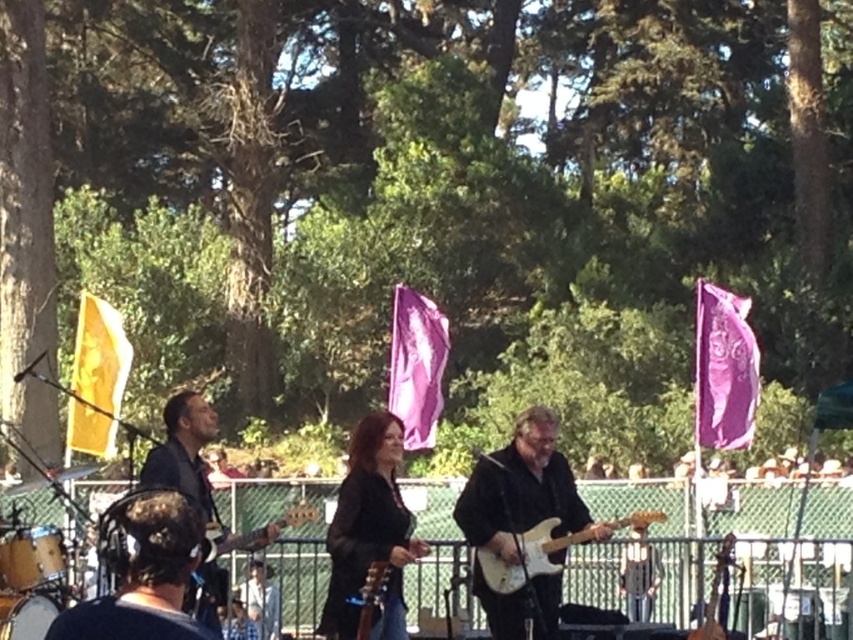
Which is above, purple fabric flag at right or metallic gold guitar at center?

purple fabric flag at right

This screenshot has height=640, width=853. Describe the element at coordinates (724, 369) in the screenshot. I see `purple fabric flag at right` at that location.

The height and width of the screenshot is (640, 853). In order to click on purple fabric flag at right in this screenshot , I will do `click(724, 369)`.

Image resolution: width=853 pixels, height=640 pixels. What are the coordinates of `purple fabric flag at right` in the screenshot? It's located at (724, 369).

Can you confirm if purple fabric flag at right is positioned below purple fabric flag at center?

Incorrect, purple fabric flag at right is not positioned below purple fabric flag at center.

Does point (740, 408) lie in front of point (426, 346)?

That is True.

Identify the location of purple fabric flag at right. (724, 369).

Is matte yellow flag at left shorter than white glossy electric guitar at center?

No.

Is matte yellow flag at left smaller than white glossy electric guitar at center?

Incorrect, matte yellow flag at left is not smaller in size than white glossy electric guitar at center.

The height and width of the screenshot is (640, 853). Find the location of `matte yellow flag at left`. matte yellow flag at left is located at coordinates (97, 376).

Identify the location of matte yellow flag at left. The height and width of the screenshot is (640, 853). (97, 376).